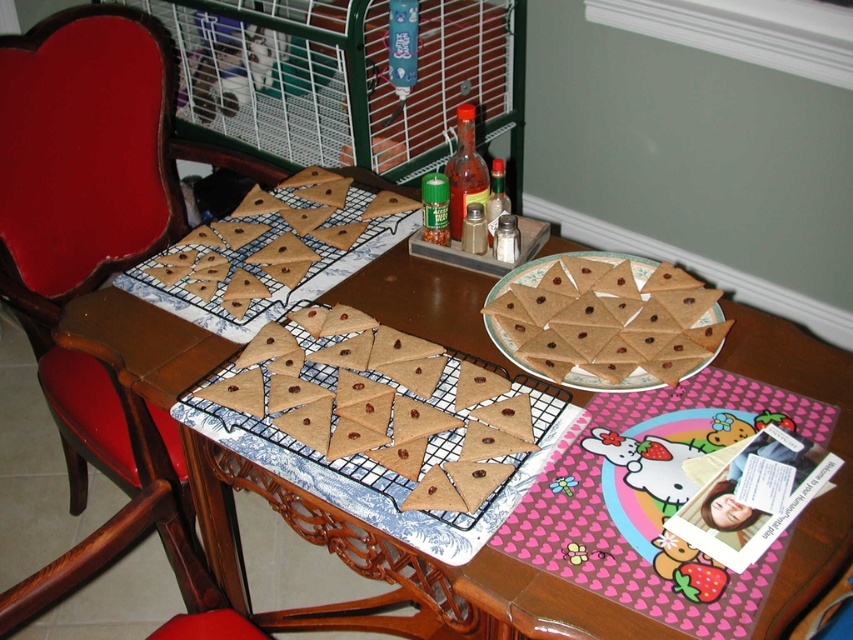
Question: From the image, what is the correct spatial relationship of wooden chair at left in relation to brown matte triangle cookies at center?

Choices:
 (A) left
 (B) right

Answer: (A)

Question: Which point is farther from the camera taking this photo?

Choices:
 (A) (212, 461)
 (B) (146, 278)

Answer: (B)

Question: Among these points, which one is nearest to the camera?

Choices:
 (A) (256, 186)
 (B) (692, 321)
 (C) (606, 628)

Answer: (C)

Question: Observing the image, what is the correct spatial positioning of brown matte triangle cookies at center in reference to brown matte triangle crackers at center?

Choices:
 (A) right
 (B) left

Answer: (B)

Question: Is the position of wooden chair at left less distant than that of brown matte triangle cookies at center?

Choices:
 (A) yes
 (B) no

Answer: (B)

Question: Considering the real-world distances, which object is closest to the brown matte cookies at center?

Choices:
 (A) brown matte triangle cookies at center
 (B) wooden chair at left
 (C) brown wood chair at lower left
 (D) brown matte triangle crackers at center

Answer: (A)